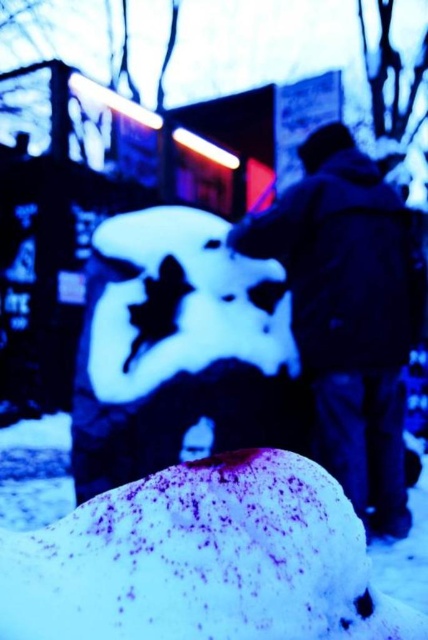
You are standing at the center of the winter scene and want to place a small decoration exactly at the location marked by the white fluffy snow at center. According to the coordinates provided, where should you place it?

The white fluffy snow at center is located at coordinates point [202,561], so you should place the decoration there.

You are standing at the edge of this winter scene and want to place a 30 cm wide snow sculpture between the white matte snowman at center and the dark blue jacket at center. Is there enough space?

The white matte snowman at center is 32.35 centimeters away from the dark blue jacket at center. Since the snow sculpture is 30 cm wide, there is enough space between them to place it.